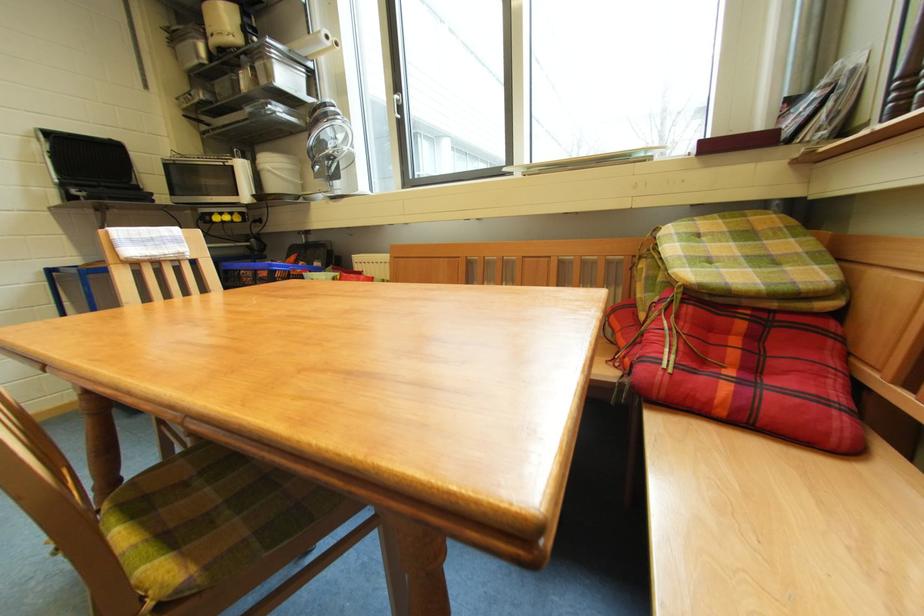
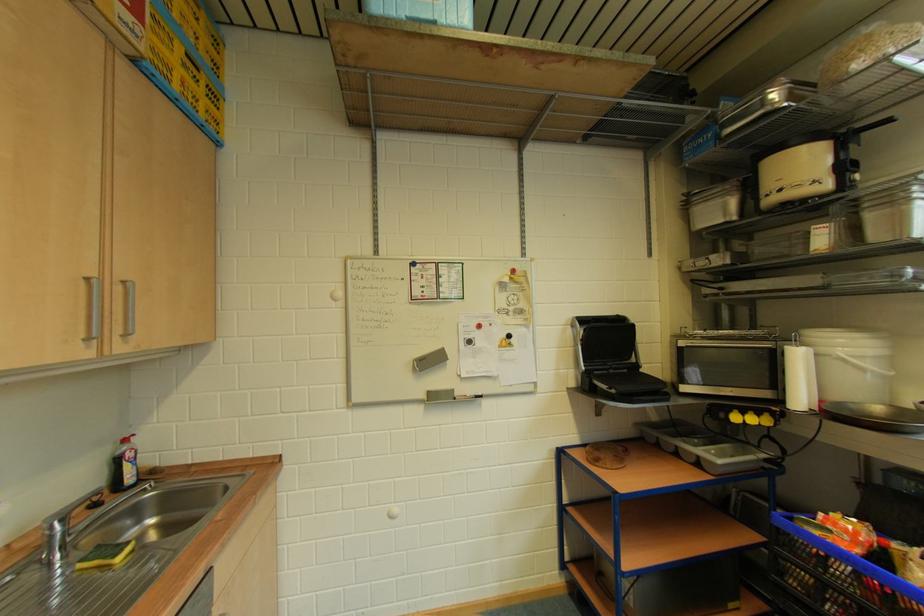
Find the pixel in the second image that matches [281,171] in the first image.

(858, 360)